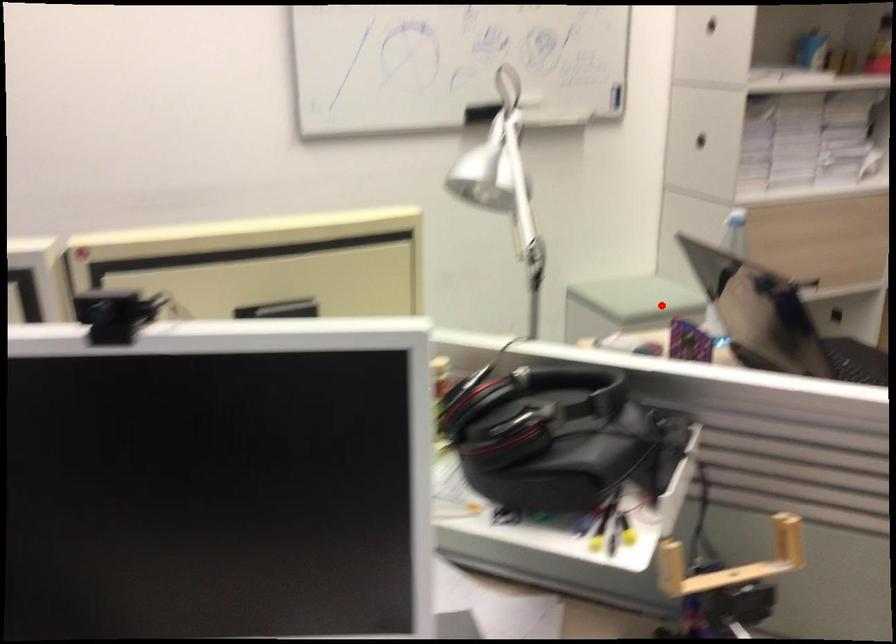
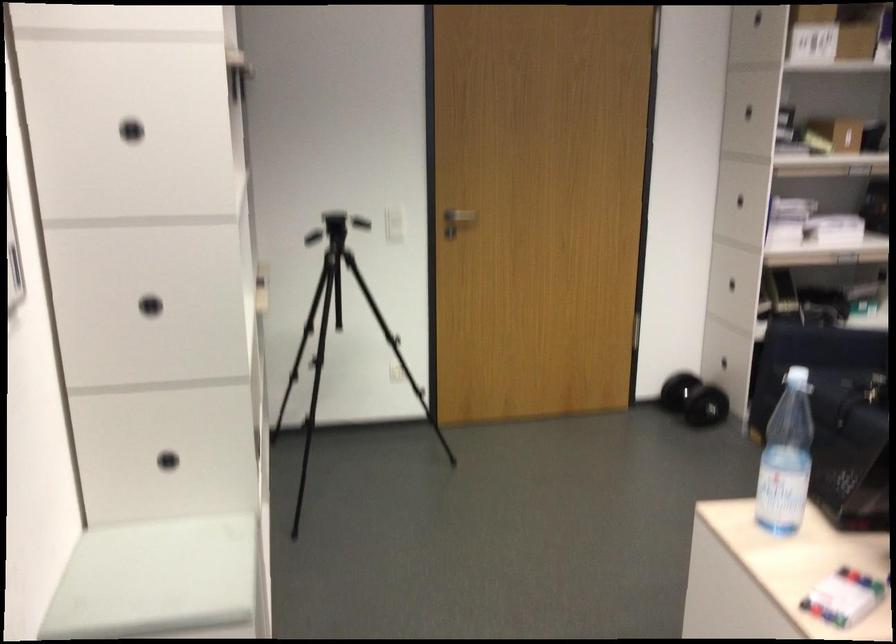
In the second image, find the point that corresponds to the highlighted location in the first image.

(159, 581)